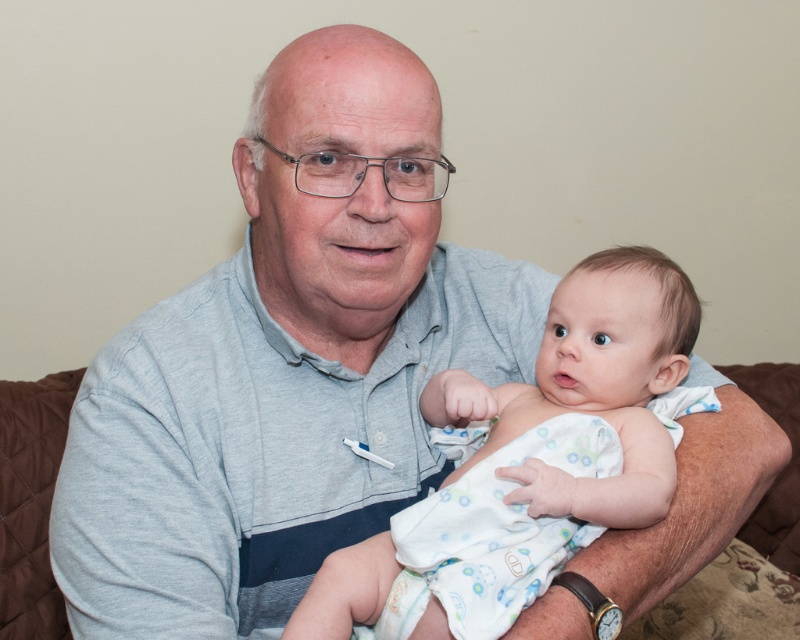
Question: Can you confirm if white cotton baby at center is smaller than brown quilted couch at center?

Choices:
 (A) yes
 (B) no

Answer: (B)

Question: Can you confirm if white cotton baby at center is positioned below brown quilted couch at center?

Choices:
 (A) no
 (B) yes

Answer: (A)

Question: Which point is farther from the camera taking this photo?

Choices:
 (A) (34, 403)
 (B) (460, 605)

Answer: (A)

Question: Which of the following is the farthest from the observer?

Choices:
 (A) white cotton baby at center
 (B) brown quilted couch at center

Answer: (B)

Question: Does white cotton baby at center have a smaller size compared to brown quilted couch at center?

Choices:
 (A) yes
 (B) no

Answer: (B)

Question: Which point is farther to the camera?

Choices:
 (A) (34, 460)
 (B) (525, 467)

Answer: (A)